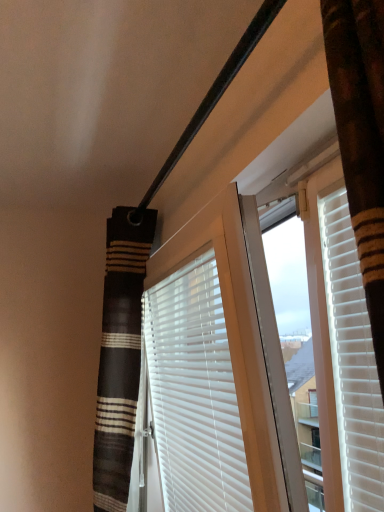
Question: Is striped fabric shower curtain at left in front of or behind white matte blinds at center in the image?

Choices:
 (A) front
 (B) behind

Answer: (B)

Question: Considering the positions of striped fabric shower curtain at left and white matte blinds at center in the image, is striped fabric shower curtain at left taller or shorter than white matte blinds at center?

Choices:
 (A) short
 (B) tall

Answer: (B)

Question: From a real-world perspective, is striped fabric shower curtain at left positioned above or below white matte blinds at center?

Choices:
 (A) below
 (B) above

Answer: (B)

Question: Based on their sizes in the image, would you say white matte blinds at center is bigger or smaller than striped fabric shower curtain at left?

Choices:
 (A) big
 (B) small

Answer: (B)

Question: Considering the positions of white matte blinds at center and striped fabric shower curtain at left in the image, is white matte blinds at center wider or thinner than striped fabric shower curtain at left?

Choices:
 (A) wide
 (B) thin

Answer: (B)

Question: Do you think white matte blinds at center is within striped fabric shower curtain at left, or outside of it?

Choices:
 (A) inside
 (B) outside

Answer: (B)

Question: Relative to striped fabric shower curtain at left, is white matte blinds at center in front or behind?

Choices:
 (A) behind
 (B) front

Answer: (B)